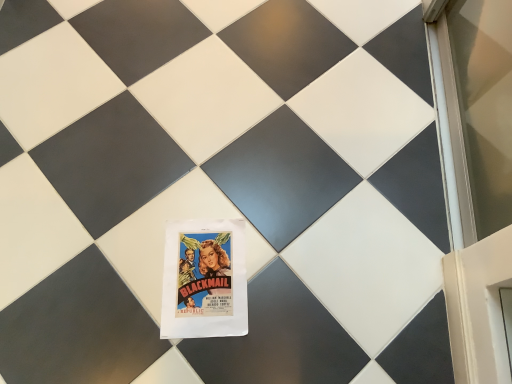
Where is `unoccupied region to the right of matte paper poster at center`? The width and height of the screenshot is (512, 384). unoccupied region to the right of matte paper poster at center is located at coordinates (294, 283).